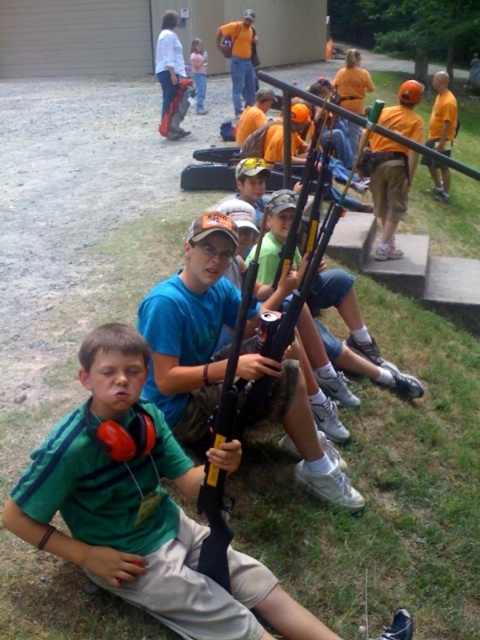
Question: Is green matte shirt at lower left to the left of orange safety vest at center from the viewer's perspective?

Choices:
 (A) no
 (B) yes

Answer: (A)

Question: Which of the following is the farthest from the observer?

Choices:
 (A) green matte shirt at lower left
 (B) orange safety vest at center

Answer: (B)

Question: Which point is farther to the camera?

Choices:
 (A) orange safety vest at center
 (B) green matte shirt at lower left

Answer: (A)

Question: Which of the following is the farthest from the observer?

Choices:
 (A) green matte shirt at lower left
 (B) orange safety vest at center

Answer: (B)

Question: Does green matte shirt at lower left appear over orange safety vest at center?

Choices:
 (A) yes
 (B) no

Answer: (B)

Question: Is green matte shirt at lower left below orange safety vest at center?

Choices:
 (A) yes
 (B) no

Answer: (A)